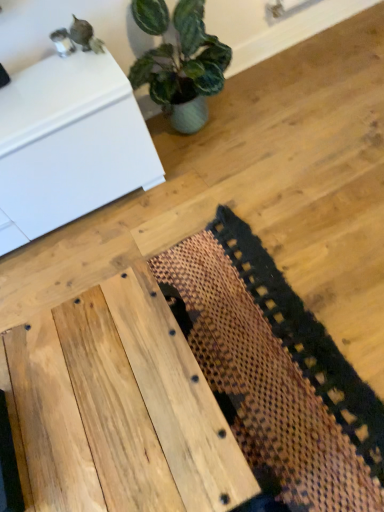
Where is `free space to the back side of brown woven mat at center`? free space to the back side of brown woven mat at center is located at coordinates (164, 196).